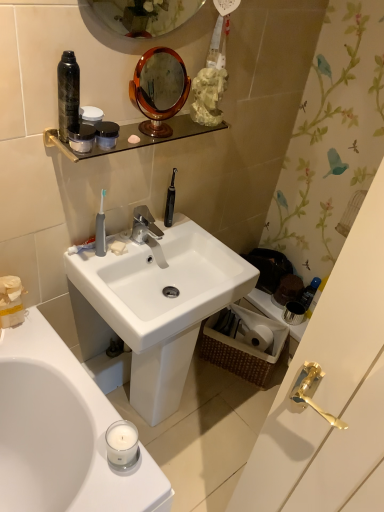
Question: Is woven brown picnic basket at lower right a part of blue glossy bottle at right, placed as the third mouthwash when sorted from top to bottom?

Choices:
 (A) yes
 (B) no

Answer: (B)

Question: Does blue glossy bottle at right, arranged as the third mouthwash when viewed from the left, have a lesser height compared to woven brown picnic basket at lower right?

Choices:
 (A) yes
 (B) no

Answer: (A)

Question: Is blue glossy bottle at right, marked as the 1th mouthwash in a back-to-front arrangement, to the left of woven brown picnic basket at lower right from the viewer's perspective?

Choices:
 (A) yes
 (B) no

Answer: (B)

Question: Can you see blue glossy bottle at right, arranged as the third mouthwash when viewed from the left, touching woven brown picnic basket at lower right?

Choices:
 (A) yes
 (B) no

Answer: (B)

Question: Does blue glossy bottle at right, arranged as the third mouthwash when viewed from the left, have a lesser width compared to woven brown picnic basket at lower right?

Choices:
 (A) no
 (B) yes

Answer: (B)

Question: From the image's perspective, is black matte spray can at upper left positioned above or below white glossy sink at center?

Choices:
 (A) below
 (B) above

Answer: (B)

Question: Considering their positions, is black matte spray can at upper left located in front of or behind white glossy sink at center?

Choices:
 (A) front
 (B) behind

Answer: (A)

Question: Is black matte spray can at upper left situated inside white glossy sink at center or outside?

Choices:
 (A) outside
 (B) inside

Answer: (A)

Question: From their relative heights in the image, would you say black matte spray can at upper left is taller or shorter than white glossy sink at center?

Choices:
 (A) short
 (B) tall

Answer: (A)

Question: Considering the positions of matte black jar at upper center, which is the first mouthwash from front to back, and black matte spray can at upper left in the image, is matte black jar at upper center, which is the first mouthwash from front to back, wider or thinner than black matte spray can at upper left?

Choices:
 (A) thin
 (B) wide

Answer: (A)

Question: Relative to black matte spray can at upper left, is matte black jar at upper center, which appears as the second mouthwash when viewed from the top, in front or behind?

Choices:
 (A) behind
 (B) front

Answer: (A)

Question: Considering the positions of point (72, 138) and point (62, 59), is point (72, 138) closer or farther from the camera than point (62, 59)?

Choices:
 (A) closer
 (B) farther

Answer: (B)

Question: From a real-world perspective, is matte black jar at upper center, which is the first mouthwash from front to back, above or below black matte spray can at upper left?

Choices:
 (A) above
 (B) below

Answer: (B)

Question: Is white matte toilet paper at lower right in front of or behind clear glass shelf at upper center in the image?

Choices:
 (A) front
 (B) behind

Answer: (B)

Question: From a real-world perspective, is white matte toilet paper at lower right physically located above or below clear glass shelf at upper center?

Choices:
 (A) above
 (B) below

Answer: (B)